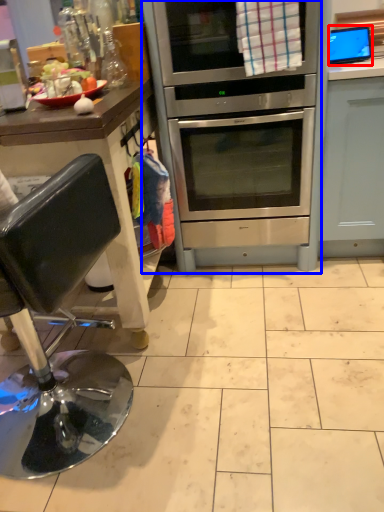
Question: Which object appears farthest to the camera in this image, appliance (highlighted by a red box) or oven (highlighted by a blue box)?

Choices:
 (A) appliance
 (B) oven

Answer: (A)